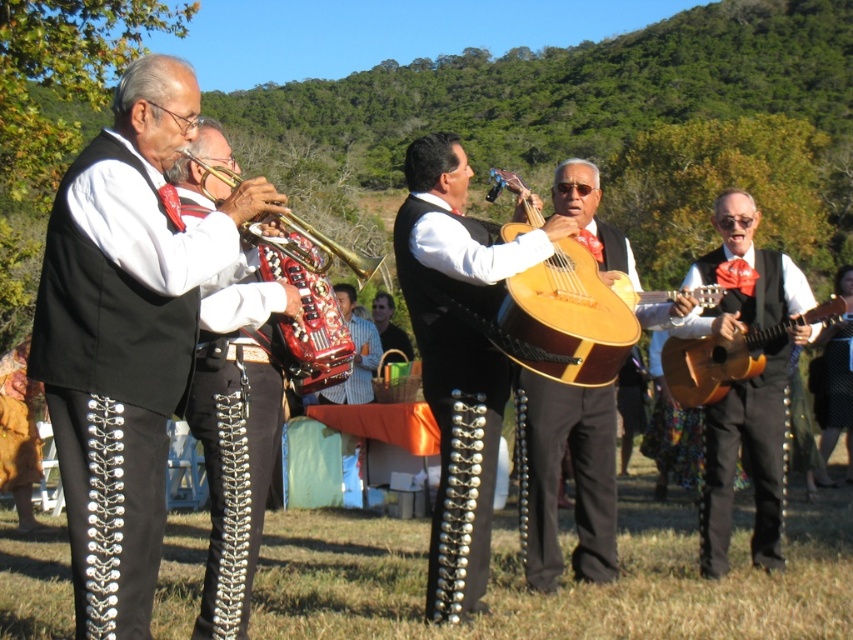
You are a photographer setting up for the mariachi band performance. You need to position a microphone stand between the matte brown guitar at right and the light brown wooden guitar at right. Since the microphone stand is 30 cm tall, will it fit between them vertically?

The matte brown guitar at right is taller than the light brown wooden guitar at right. Since the microphone stand is only 30 cm tall, it should fit vertically between them as long as there is enough space between the two guitars.

You are a photographer trying to capture the mariachi band members. You notice the shiny black pants at left and the matte brown guitar at right. Which object is closer to the bottom edge of the photo?

The shiny black pants at left is positioned under the matte brown guitar at right, so it is closer to the bottom edge of the photo.

You are a photographer setting up for the mariachi band performance. You need to position a microphone stand between the matte brown guitar at right and the wooden acoustic guitar at center. Which guitar should the microphone stand be closer to if you want it to be closer to the taller guitar?

The wooden acoustic guitar at center is taller than the matte brown guitar at right, so the microphone stand should be closer to the wooden acoustic guitar at center.